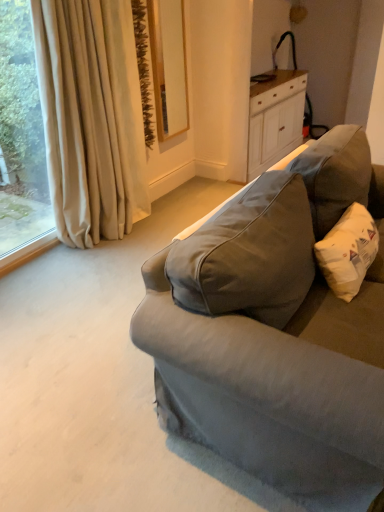
The image size is (384, 512). I want to click on beige curtain at left, so click(x=21, y=136).

Image resolution: width=384 pixels, height=512 pixels. What do you see at coordinates (91, 117) in the screenshot? I see `beige fabric curtain at left` at bounding box center [91, 117].

Locate an element on the screen. The height and width of the screenshot is (512, 384). white wood cabinet at upper right is located at coordinates (275, 119).

This screenshot has width=384, height=512. I want to click on matte gray fabric couch at right, so click(274, 329).

Does point (27, 112) come farther from viewer compared to point (112, 23)?

Yes.

Which of these two, beige curtain at left or beige fabric curtain at left, is bigger?

Bigger between the two is beige fabric curtain at left.

From the image's perspective, is beige curtain at left positioned above or below beige fabric curtain at left?

From the image's perspective, beige curtain at left appears below beige fabric curtain at left.

Find the location of a particular element. This screenshot has height=512, width=384. window above the beige fabric curtain at left (from a real-world perspective) is located at coordinates (21, 136).

Considering the sizes of objects white wood cabinet at upper right and white cotton pillow at right in the image provided, who is bigger, white wood cabinet at upper right or white cotton pillow at right?

With larger size is white wood cabinet at upper right.

Could white cotton pillow at right be considered to be inside white wood cabinet at upper right?

No, white cotton pillow at right is not inside white wood cabinet at upper right.

Who is taller, white wood cabinet at upper right or white cotton pillow at right?

white wood cabinet at upper right is taller.

Based on the photo, is white wood cabinet at upper right aimed at white cotton pillow at right?

No, white wood cabinet at upper right is not oriented towards white cotton pillow at right.

Between beige fabric curtain at left and white wood cabinet at upper right, which one has less height?

With less height is white wood cabinet at upper right.

Considering the sizes of objects beige fabric curtain at left and white wood cabinet at upper right in the image provided, who is thinner, beige fabric curtain at left or white wood cabinet at upper right?

beige fabric curtain at left.

From a real-world perspective, who is located lower, beige fabric curtain at left or white wood cabinet at upper right?

In real-world perspective, white wood cabinet at upper right is lower.

Is beige fabric curtain at left far from white wood cabinet at upper right?

Yes, beige fabric curtain at left and white wood cabinet at upper right are located far from each other.

Is white wood cabinet at upper right touching matte gray fabric couch at right?

No, white wood cabinet at upper right is not in contact with matte gray fabric couch at right.

From a real-world perspective, does white wood cabinet at upper right sit lower than matte gray fabric couch at right?

Correct, in the physical world, white wood cabinet at upper right is lower than matte gray fabric couch at right.

From the image's perspective, which is above, white wood cabinet at upper right or matte gray fabric couch at right?

white wood cabinet at upper right appears higher in the image.

Considering the sizes of objects white wood cabinet at upper right and matte gray fabric couch at right in the image provided, who is thinner, white wood cabinet at upper right or matte gray fabric couch at right?

white wood cabinet at upper right.

How distant is beige curtain at left from matte gray fabric couch at right?

They are 1.89 meters apart.

In the scene shown: Is beige curtain at left wider or thinner than matte gray fabric couch at right?

beige curtain at left is thinner than matte gray fabric couch at right.

Are beige curtain at left and matte gray fabric couch at right far apart?

Absolutely, beige curtain at left is distant from matte gray fabric couch at right.

From a real-world perspective, between beige curtain at left and matte gray fabric couch at right, who is vertically lower?

matte gray fabric couch at right is physically lower.

Is the surface of white cotton pillow at right in direct contact with beige fabric curtain at left?

No.

Does white cotton pillow at right have a lesser height compared to beige fabric curtain at left?

Yes.

Could you tell me if white cotton pillow at right is turned towards beige fabric curtain at left?

No.

Is white cotton pillow at right completely or partially outside of beige fabric curtain at left?

white cotton pillow at right lies outside beige fabric curtain at left's area.

In the image, there is a matte gray fabric couch at right. Where is `curtain above it (from the image's perspective)`? The height and width of the screenshot is (512, 384). curtain above it (from the image's perspective) is located at coordinates (91, 117).

Is matte gray fabric couch at right bigger or smaller than beige fabric curtain at left?

matte gray fabric couch at right is bigger than beige fabric curtain at left.

From the image's perspective, is matte gray fabric couch at right above beige fabric curtain at left?

No, from the image's perspective, matte gray fabric couch at right is not over beige fabric curtain at left.

Is matte gray fabric couch at right facing towards beige fabric curtain at left?

No.

In the image, there is a beige curtain at left. Find the location of `curtain below it (from a real-world perspective)`. curtain below it (from a real-world perspective) is located at coordinates (91, 117).

Where is `cabinetry behind the white cotton pillow at right`? This screenshot has height=512, width=384. cabinetry behind the white cotton pillow at right is located at coordinates (275, 119).

From the image, which object appears to be nearer to white wood cabinet at upper right, matte gray fabric couch at right or beige fabric curtain at left?

beige fabric curtain at left is closer to white wood cabinet at upper right.

Estimate the real-world distances between objects in this image. Which object is closer to white cotton pillow at right, matte gray fabric couch at right or white wood cabinet at upper right?

matte gray fabric couch at right is closer to white cotton pillow at right.

Considering their positions, is white wood cabinet at upper right positioned closer to matte gray fabric couch at right than beige curtain at left?

The object closer to matte gray fabric couch at right is beige curtain at left.

When comparing their distances from beige fabric curtain at left, does beige curtain at left or white wood cabinet at upper right seem closer?

beige curtain at left is closer to beige fabric curtain at left.

From the image, which object appears to be farther from matte gray fabric couch at right, white wood cabinet at upper right or white cotton pillow at right?

The object further to matte gray fabric couch at right is white wood cabinet at upper right.

Estimate the real-world distances between objects in this image. Which object is closer to matte gray fabric couch at right, beige curtain at left or beige fabric curtain at left?

beige fabric curtain at left is positioned closer to the anchor matte gray fabric couch at right.

Estimate the real-world distances between objects in this image. Which object is further from white cotton pillow at right, beige curtain at left or beige fabric curtain at left?

beige curtain at left is positioned further to the anchor white cotton pillow at right.

Based on their spatial positions, is white wood cabinet at upper right or beige curtain at left closer to beige fabric curtain at left?

Based on the image, beige curtain at left appears to be nearer to beige fabric curtain at left.

What are the coordinates of `curtain between beige curtain at left and white cotton pillow at right from left to right` in the screenshot? It's located at (91, 117).

I want to click on curtain between white cotton pillow at right and white wood cabinet at upper right in the front-back direction, so click(x=91, y=117).

Locate an element on the screen. throw pillow between matte gray fabric couch at right and white wood cabinet at upper right in the front-back direction is located at coordinates (348, 251).

Image resolution: width=384 pixels, height=512 pixels. What are the coordinates of `studio couch between beige fabric curtain at left and white cotton pillow at right` in the screenshot? It's located at (274, 329).